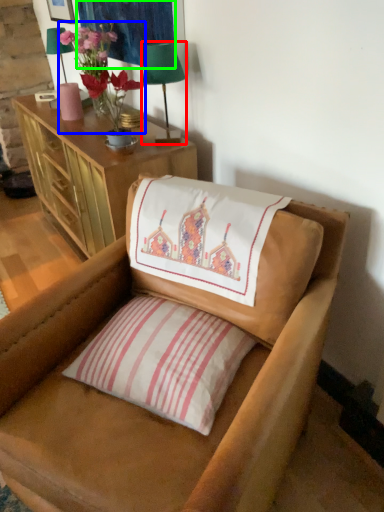
Question: Based on their relative distances, which object is farther from table lamp (highlighted by a red box)? Choose from floral arrangement (highlighted by a blue box) and tapestry (highlighted by a green box).

Choices:
 (A) floral arrangement
 (B) tapestry

Answer: (B)